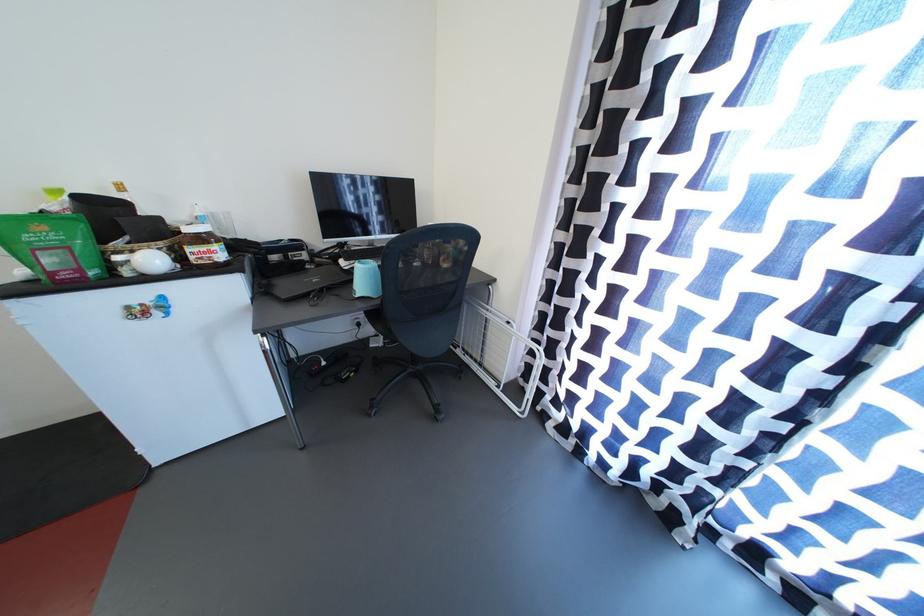
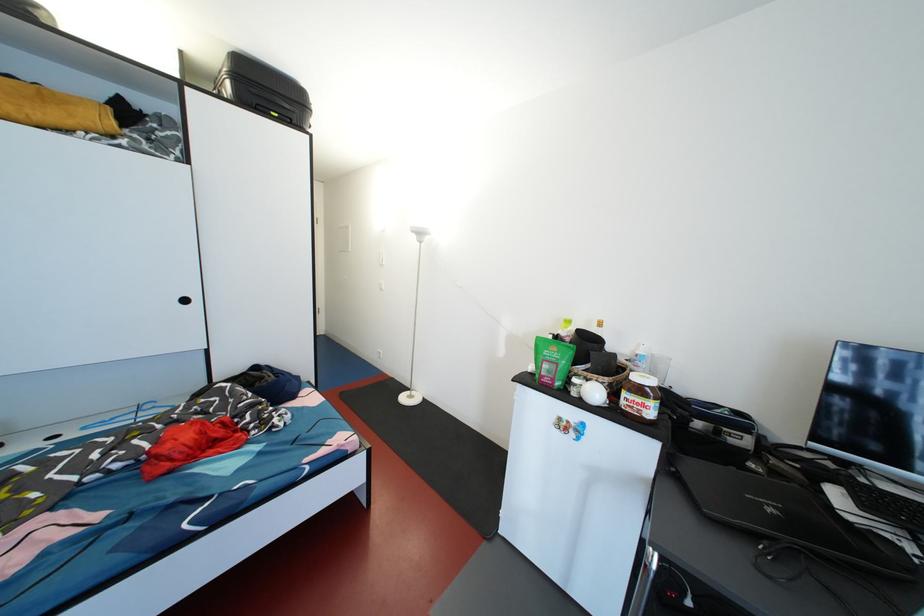
Find the pixel in the second image that matches the point at 40,286 in the first image.

(539, 379)